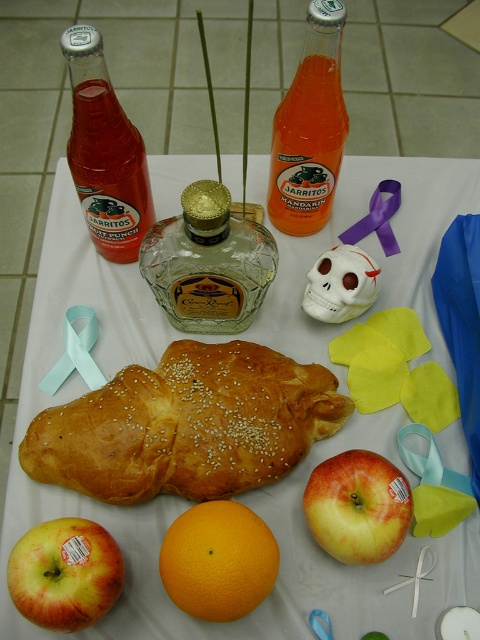
Question: Does golden brown crusty loaf at center have a lesser width compared to purple satin ribbon at center?

Choices:
 (A) no
 (B) yes

Answer: (A)

Question: Which point appears farthest from the camera in this image?

Choices:
 (A) (357, 515)
 (B) (261, 570)
 (C) (121, 173)
 (D) (320, 285)

Answer: (D)

Question: Is golden brown crusty loaf at center positioned before translucent glass bottle at center?

Choices:
 (A) no
 (B) yes

Answer: (A)

Question: Can you confirm if reddish-yellow matte apple at lower left is wider than white matte skull at center?

Choices:
 (A) yes
 (B) no

Answer: (A)

Question: Estimate the real-world distances between objects in this image. Which object is farther from the translucent glass bottle at upper left?

Choices:
 (A) translucent glass bottle at center
 (B) red matte apple at center
 (C) reddish-yellow matte apple at lower left
 (D) clear glass bottle at center

Answer: (B)

Question: Which point is farther to the camera?

Choices:
 (A) (158, 390)
 (B) (338, 308)
 (C) (386, 205)
 (D) (130, 232)

Answer: (C)